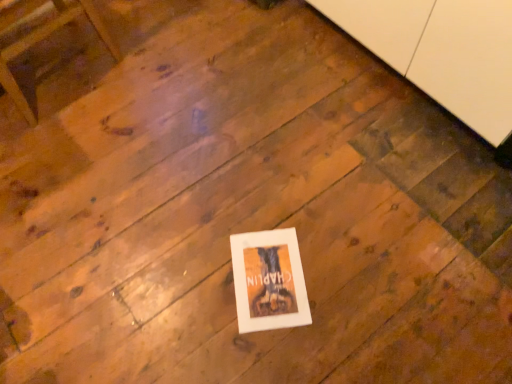
This screenshot has height=384, width=512. I want to click on vacant area that is in front of white paper at center, so click(x=272, y=352).